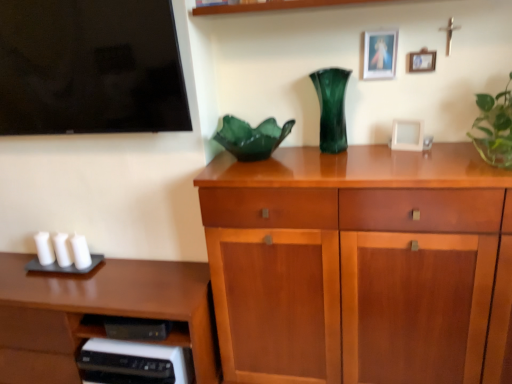
Identify the location of blank area to the left of white matte candle at left, the second candle viewed from the left. The height and width of the screenshot is (384, 512). (14, 267).